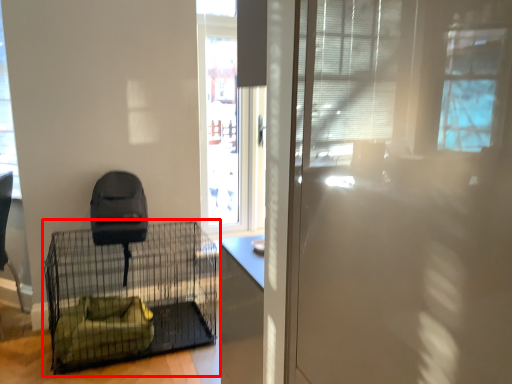
Question: Where is furniture (annotated by the red box) located in relation to window in the image?

Choices:
 (A) right
 (B) left

Answer: (A)